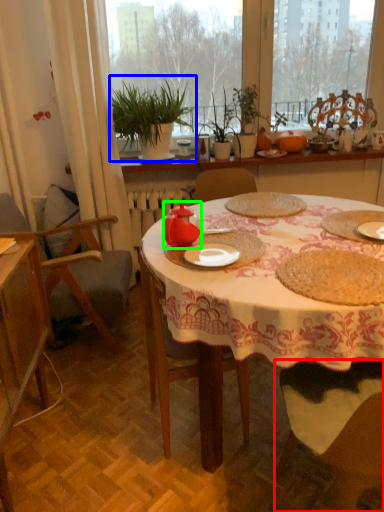
Question: Considering the real-world distances, which object is farthest from chair (highlighted by a red box)? houseplant (highlighted by a blue box) or teapot (highlighted by a green box)?

Choices:
 (A) houseplant
 (B) teapot

Answer: (A)